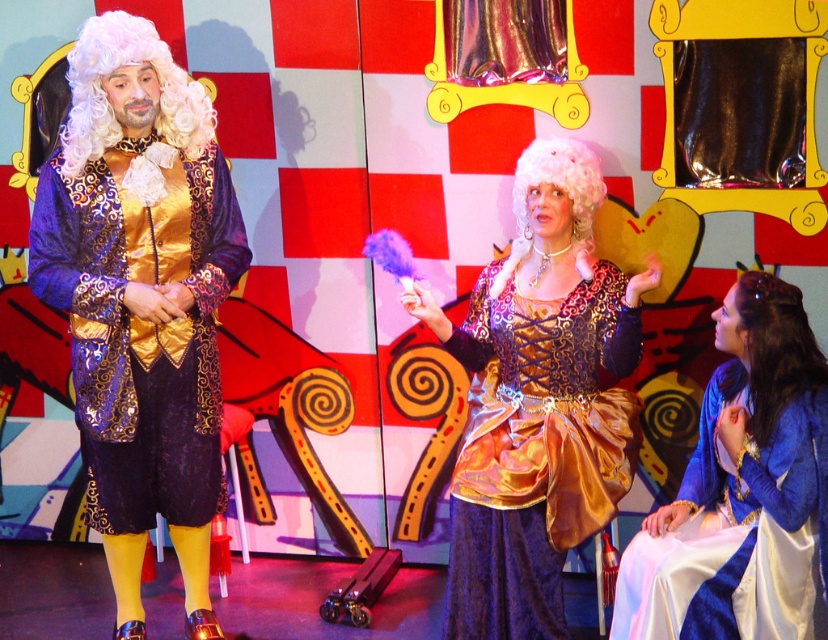
Is shiny gold vest at center to the left of gold satin dress at center from the viewer's perspective?

Yes, shiny gold vest at center is to the left of gold satin dress at center.

Is shiny gold vest at center smaller than gold satin dress at center?

Correct, shiny gold vest at center occupies less space than gold satin dress at center.

Is point (189, 589) farther from viewer compared to point (614, 468)?

Yes, point (189, 589) is farther from viewer.

Image resolution: width=828 pixels, height=640 pixels. What are the coordinates of `shiny gold vest at center` in the screenshot? It's located at (141, 300).

Looking at this image, which of these two, gold satin dress at center or white curly wig at center, stands shorter?

white curly wig at center

Between point (634, 403) and point (523, 182), which one is positioned in front?

Point (523, 182) is in front.

Image resolution: width=828 pixels, height=640 pixels. Describe the element at coordinates (538, 401) in the screenshot. I see `gold satin dress at center` at that location.

Where is `gold satin dress at center`? gold satin dress at center is located at coordinates (538, 401).

Which is more to the left, gold satin dress at center or satin blue dress at center?

gold satin dress at center is more to the left.

Does gold satin dress at center appear over satin blue dress at center?

Yes.

Is point (610, 392) farther from viewer compared to point (810, 566)?

That is True.

Identify the location of gold satin dress at center. (538, 401).